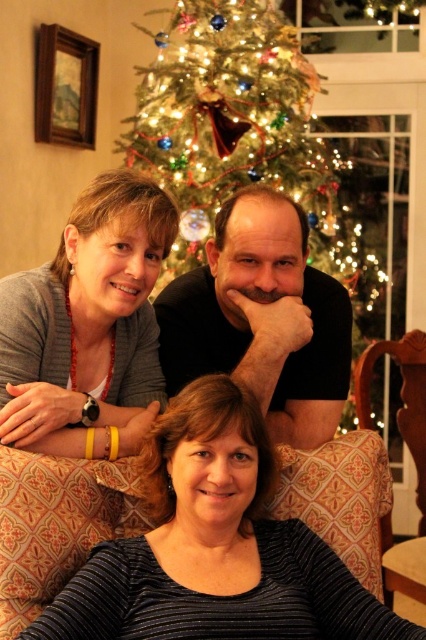
In the festive living room scene, there are two people wearing the black ribbed sweater at lower center and the matte gray sweater at center. Which sweater is positioned more to the right?

The black ribbed sweater at lower center is positioned more to the right than the matte gray sweater at center.

You are a photographer setting up a camera to take a portrait of the three people on the couch. You want to ensure that the iridescent glass ornaments at center and the matte gray sweater at center are both in focus. Which object should you adjust your camera focus to prioritize to ensure both are sharp?

The iridescent glass ornaments at center is taller than the matte gray sweater at center. To ensure both are in focus, prioritize focusing on the matte gray sweater at center since it is shorter, allowing the depth of field to cover the taller ornaments as well.

You are a guest at a Christmas party and see the iridescent glass ornaments at center. Where exactly are they located in the room?

The iridescent glass ornaments at center are located at point [241,177] in the room.